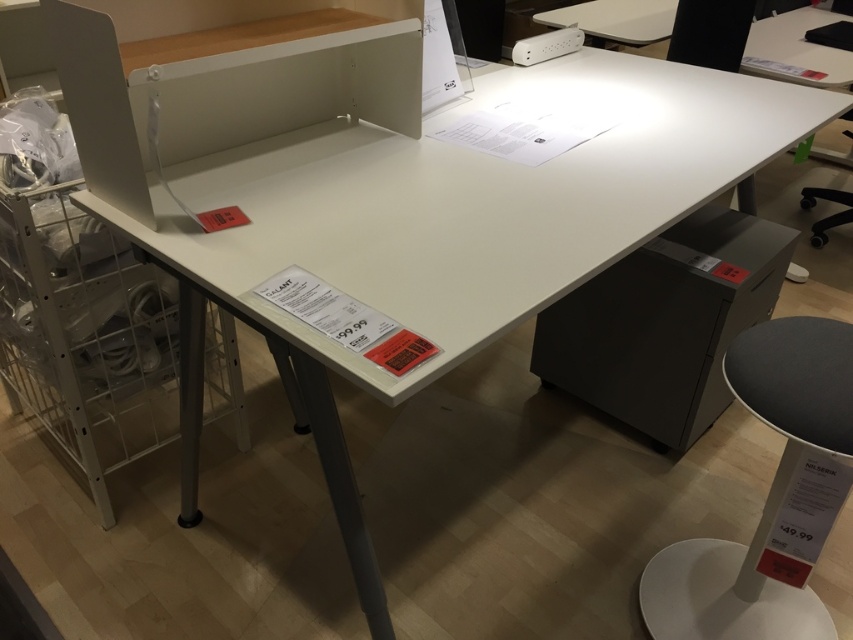
Who is shorter, white plastic stool at lower right or white plastic power strip at upper center?

white plastic power strip at upper center is shorter.

Does white plastic stool at lower right have a lesser width compared to white plastic power strip at upper center?

No.

Which is in front, point (791, 486) or point (572, 44)?

Point (791, 486) is more forward.

The image size is (853, 640). Identify the location of white plastic stool at lower right. pos(769,497).

Does matte gray drawer at lower right have a lesser height compared to white plastic power strip at upper center?

In fact, matte gray drawer at lower right may be taller than white plastic power strip at upper center.

Which is in front, point (706, 401) or point (566, 29)?

Point (706, 401) is in front.

Where is `matte gray drawer at lower right`? Image resolution: width=853 pixels, height=640 pixels. matte gray drawer at lower right is located at coordinates (665, 323).

Is white plastic stool at lower right above matte gray drawer at lower right?

Actually, white plastic stool at lower right is below matte gray drawer at lower right.

Between white plastic stool at lower right and matte gray drawer at lower right, which one appears on the left side from the viewer's perspective?

white plastic stool at lower right is more to the left.

Who is more distant from viewer, [682,625] or [722,378]?

Point [722,378]

Locate an element on the screen. The height and width of the screenshot is (640, 853). white plastic stool at lower right is located at coordinates (769, 497).